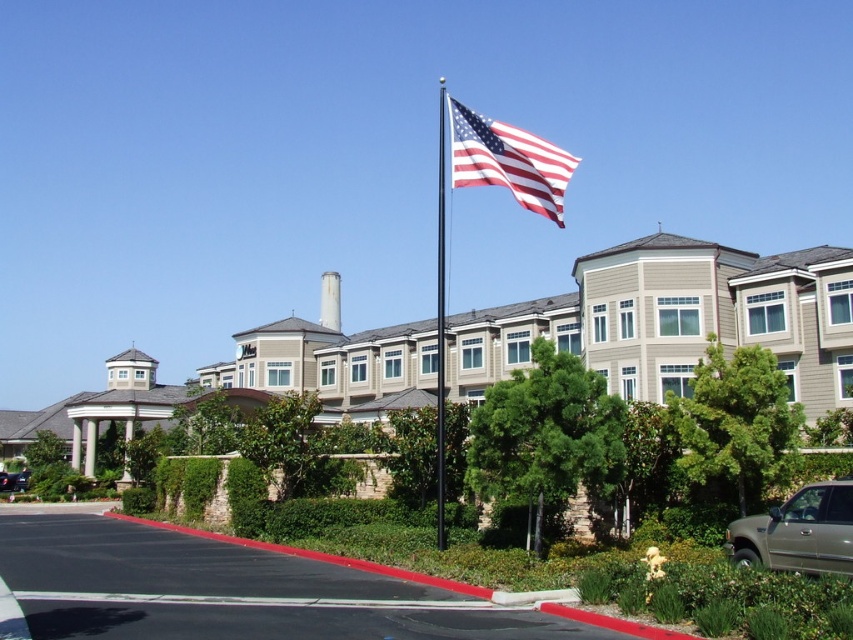
You are a photographer planning to capture the gold metallic truck at lower right and the american flag at upper center in a single shot. Considering their sizes in the image, which object would appear larger in the final photograph?

The american flag at upper center would appear larger in the final photograph since the gold metallic truck at lower right is smaller than the american flag at upper center according to the description.

You are standing in front of the suburban building and want to take a photo. There are two points marked in the image, point (840, 515) and point (25, 483). Which point will appear larger in your photo?

Point (840, 515) is closer to the camera than point (25, 483), so it will appear larger in the photo.

You are planning to park a new car that is 1.8 meters wide in this suburban setting. You have two options for parking spots near the gold metallic truck at lower right and the shiny black sedan at lower left. Based on their widths, which parking spot would be more suitable for your car?

The gold metallic truck at lower right has a lesser width compared to the shiny black sedan at lower left, so the parking spot near the gold metallic truck at lower right would be more suitable since it likely has a narrower width requirement.